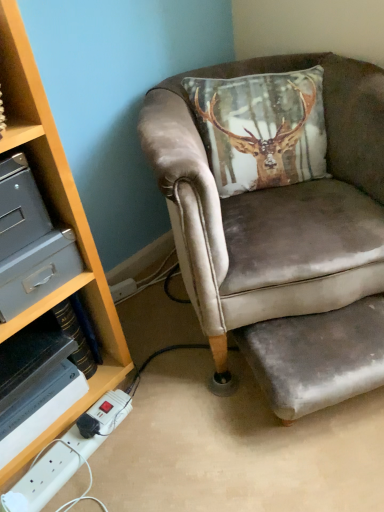
I want to click on free area in between velvet brown armchair at center and white plastic power strip at lower left, so click(x=165, y=375).